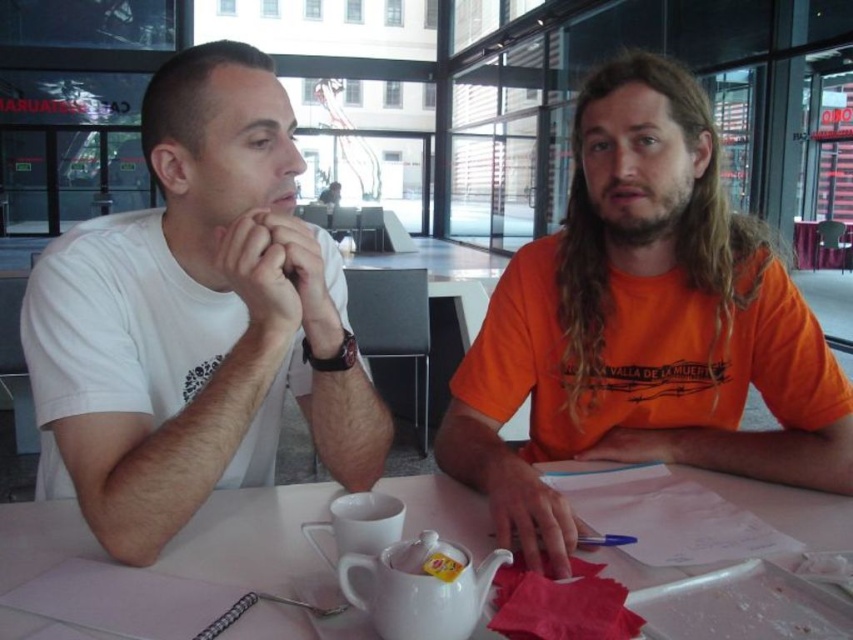
You are a waiter in a busy restaurant and need to place a new teapot on the table between the orange cotton shirt at center and the white glossy tea pot at center. Where should you place it to ensure it is between them?

The orange cotton shirt at center is positioned on the right side of white glossy tea pot at center, so placing the new teapot to the left of the existing white glossy tea pot at center would place it between the two objects.